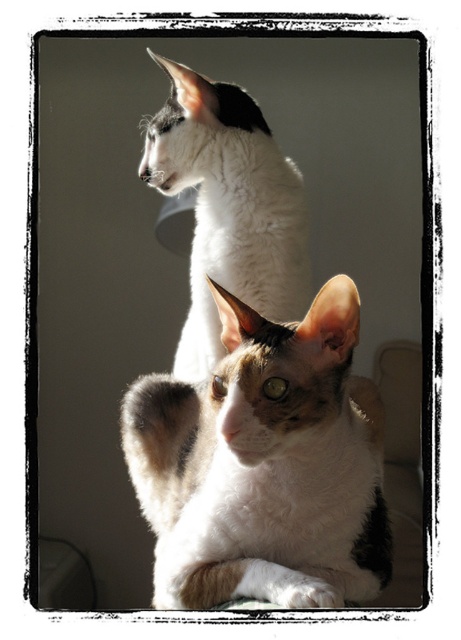
I want to click on calico fur cat at center, so click(x=265, y=465).

Can you confirm if calico fur cat at center is positioned above white fur cat at upper center?

No, calico fur cat at center is not above white fur cat at upper center.

This screenshot has height=640, width=461. Describe the element at coordinates (265, 465) in the screenshot. I see `calico fur cat at center` at that location.

The height and width of the screenshot is (640, 461). I want to click on calico fur cat at center, so click(265, 465).